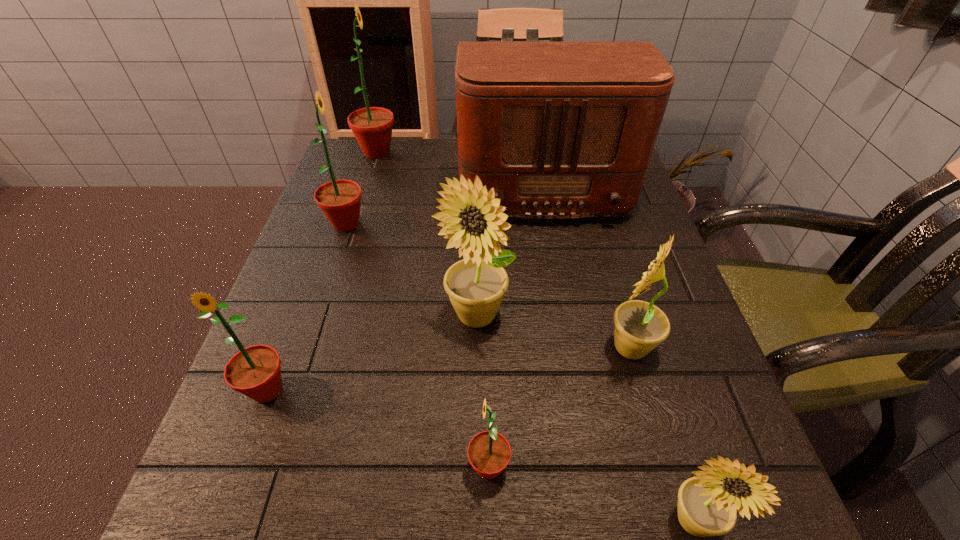
Identify the location of sunflower that is the fourth closest to the tallest sunflower. (639, 326).

Find the location of a particular element. The height and width of the screenshot is (540, 960). the third closest sunflower to the third biggest green sunflower is located at coordinates (340, 200).

Choose which green sunflower is the nearest neighbor to the second smallest green sunflower. Please provide its 2D coordinates. Your answer should be formatted as a tuple, i.e. [(x, y)], where the tuple contains the x and y coordinates of a point satisfying the conditions above.

[(489, 452)]

Select which green sunflower is the second closest to the radio receiver. Please provide its 2D coordinates. Your answer should be formatted as a tuple, i.e. [(x, y)], where the tuple contains the x and y coordinates of a point satisfying the conditions above.

[(340, 200)]

Identify which yellow sunflower is the second nearest to the nearest object. Please provide its 2D coordinates. Your answer should be formatted as a tuple, i.e. [(x, y)], where the tuple contains the x and y coordinates of a point satisfying the conditions above.

[(476, 286)]

You are a GUI agent. You are given a task and a screenshot of the screen. Output one action in this format:
    pyautogui.click(x=<x>, y=<y>)
    Task: Click on the yellow sunflower that is the closest to the biggest green sunflower
    
    Given the screenshot: What is the action you would take?
    pyautogui.click(x=476, y=286)

Where is `free spot that satisfies the following two spatial constraints: 1. on the face of the farthest sunflower; 2. on the face of the third farthest green sunflower`? Image resolution: width=960 pixels, height=540 pixels. free spot that satisfies the following two spatial constraints: 1. on the face of the farthest sunflower; 2. on the face of the third farthest green sunflower is located at coordinates click(303, 390).

This screenshot has width=960, height=540. I want to click on vacant point that satisfies the following two spatial constraints: 1. on the front panel of the brown radio receiver; 2. on the face of the second farthest green sunflower, so click(x=549, y=224).